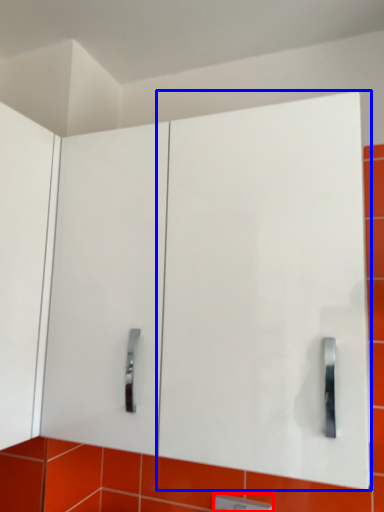
Question: Which point is further to the camera, light switch (highlighted by a red box) or glass door (highlighted by a blue box)?

Choices:
 (A) light switch
 (B) glass door

Answer: (A)